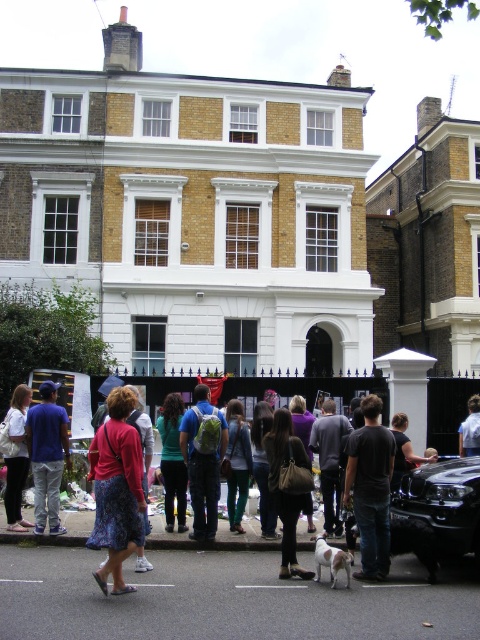
Is matte green backpack at center above matte blue jeans at left?

Yes.

Is point (211, 422) farther from camera compared to point (37, 531)?

That is True.

Is point (206, 483) less distant than point (55, 381)?

Yes.

Where is `matte green backpack at center`? The image size is (480, 640). matte green backpack at center is located at coordinates (203, 460).

Who is shorter, black cotton shirt at center or white cotton shirt at center?

Standing shorter between the two is black cotton shirt at center.

Consider the image. Is black cotton shirt at center behind white cotton shirt at center?

No, black cotton shirt at center is closer to the viewer.

You are a GUI agent. You are given a task and a screenshot of the screen. Output one action in this format:
    pyautogui.click(x=<x>, y=<y>)
    Task: Click on the black cotton shirt at center
    The width and height of the screenshot is (480, 640).
    Given the screenshot: What is the action you would take?
    pyautogui.click(x=371, y=488)

Find the location of a particular element. black cotton shirt at center is located at coordinates (371, 488).

Can you confirm if black cotton shirt at center is bigger than denim jacket at lower left?

Incorrect, black cotton shirt at center is not larger than denim jacket at lower left.

Can you confirm if black cotton shirt at center is positioned above denim jacket at lower left?

Incorrect, black cotton shirt at center is not positioned above denim jacket at lower left.

Which is behind, point (377, 449) or point (23, 440)?

The point (23, 440) is behind.

Locate an element on the screen. The image size is (480, 640). black cotton shirt at center is located at coordinates (371, 488).